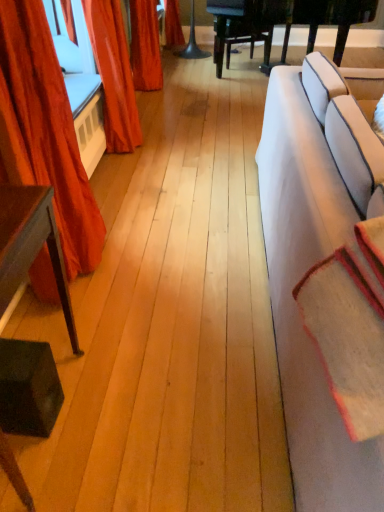
Image resolution: width=384 pixels, height=512 pixels. I want to click on free space in front of velvet red curtain at left, acting as the 2th curtain starting from the back, so tap(82, 327).